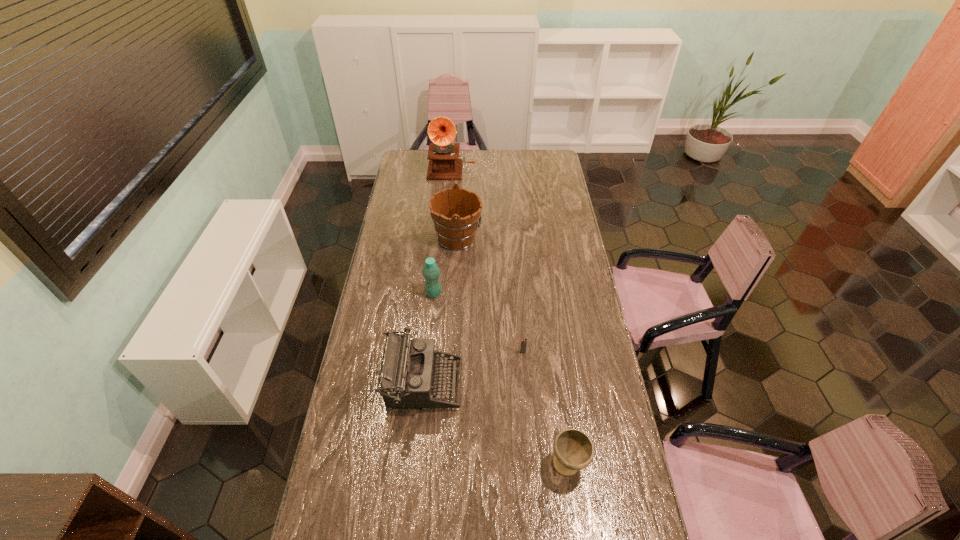
Locate an element on the screen. This screenshot has width=960, height=540. phonograph record is located at coordinates (444, 163).

The width and height of the screenshot is (960, 540). I want to click on the farthest object, so click(x=444, y=163).

The width and height of the screenshot is (960, 540). Find the location of `the second farthest object`. the second farthest object is located at coordinates (455, 211).

This screenshot has height=540, width=960. Find the location of `the second tallest object`. the second tallest object is located at coordinates (455, 211).

Locate an element on the screen. The height and width of the screenshot is (540, 960). water bottle is located at coordinates (431, 272).

At what (x,y) coordinates should I click in order to perform the action: click on typewriter. Please return your answer as a coordinate pair (x, y). Looking at the image, I should click on pos(406,381).

Identify the location of the second shortest object. The width and height of the screenshot is (960, 540). (574, 450).

Identify the location of chalice. (574, 450).

The width and height of the screenshot is (960, 540). Find the location of `igniter`. igniter is located at coordinates (523, 346).

Find the location of a particular element. This screenshot has width=960, height=540. the fifth object from left to right is located at coordinates (x=523, y=346).